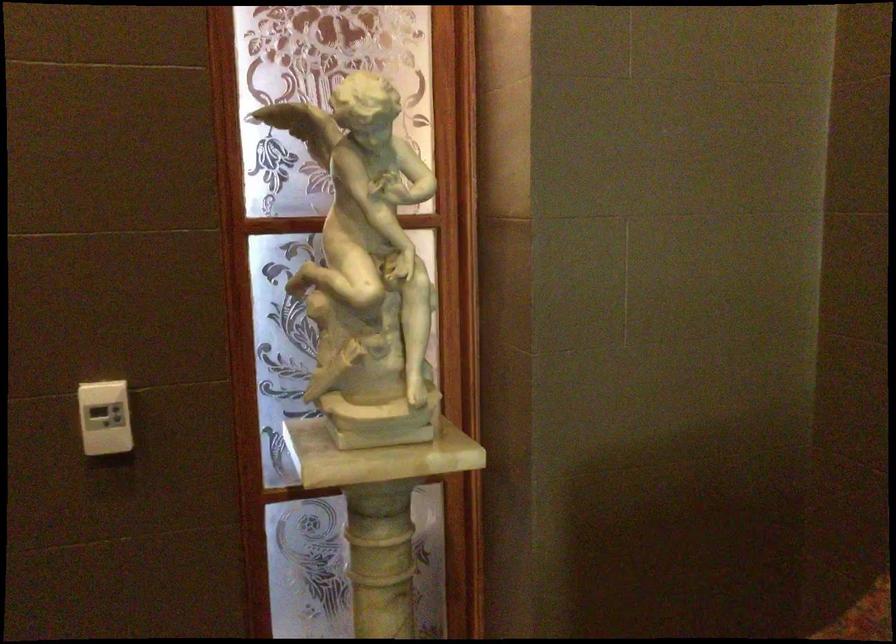
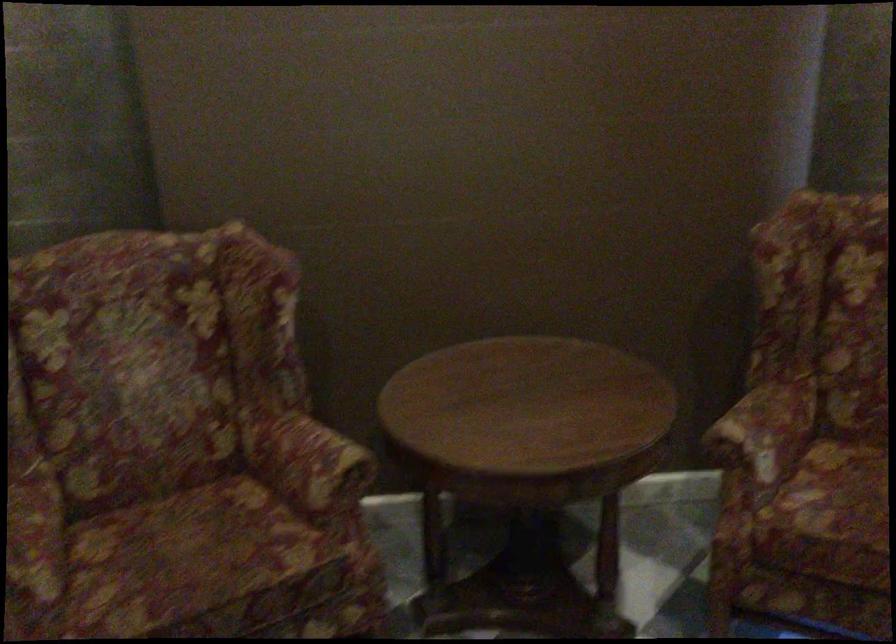
The first image is from the beginning of the video and the second image is from the end. How did the camera likely rotate when shooting the video?

The camera's rotation is toward right-down.